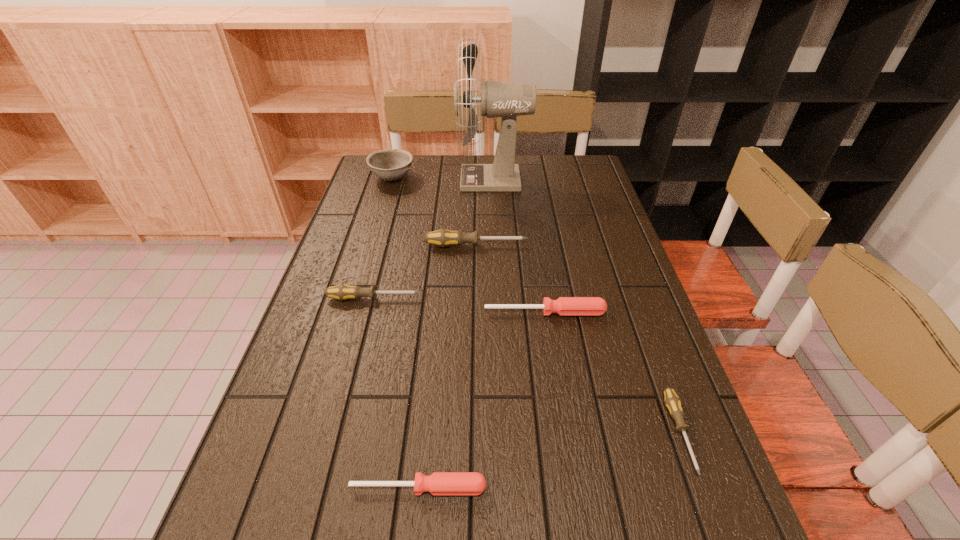
Where is `the nearer red screwdriver`? This screenshot has height=540, width=960. the nearer red screwdriver is located at coordinates (439, 483).

The image size is (960, 540). Identify the location of the left red screwdriver. [439, 483].

Where is `the rightmost gray screwdriver`? the rightmost gray screwdriver is located at coordinates (674, 404).

Image resolution: width=960 pixels, height=540 pixels. Identify the location of the rightmost screwdriver. (674, 404).

What are the coordinates of `vacant space located 0.100m on the air flow direction of the gray fan` in the screenshot? It's located at (430, 180).

This screenshot has width=960, height=540. In order to click on free space located on the air flow direction of the gray fan in this screenshot , I will do `click(394, 180)`.

You are a GUI agent. You are given a task and a screenshot of the screen. Output one action in this format:
    pyautogui.click(x=<x>, y=<y>)
    Task: Click on the vacant region located on the air flow direction of the gray fan
    The image size is (960, 540).
    Given the screenshot: What is the action you would take?
    pyautogui.click(x=385, y=180)

The image size is (960, 540). Identify the location of free space located on the right of the sixth shortest object. (504, 178).

Identify the location of blank space located 0.120m at the tip of the farthest screwdriver. This screenshot has height=540, width=960. (568, 245).

You are a GUI agent. You are given a task and a screenshot of the screen. Output one action in this format:
    pyautogui.click(x=<x>, y=<y>)
    Task: Click on the vacant area situated at the tip of the second biggest gray screwdriver
    The height and width of the screenshot is (540, 960).
    Given the screenshot: What is the action you would take?
    pyautogui.click(x=515, y=298)